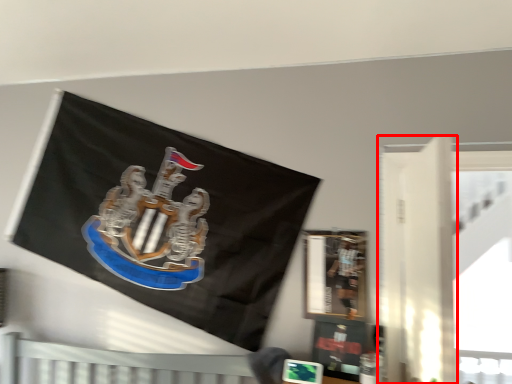
Question: From the image's perspective, where is door (annotated by the red box) located in relation to person in the image?

Choices:
 (A) above
 (B) below

Answer: (A)